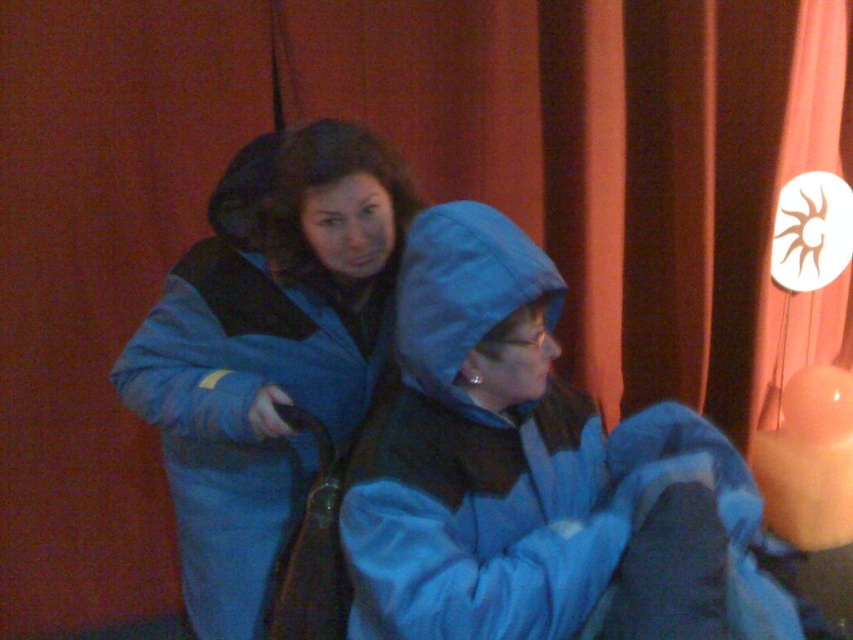
You are trying to decide which coat to wear for a walk in the cold evening. You see the blue fleece jacket at center and the blue fuzzy coat at center in the image. Which one is shorter in height?

The blue fleece jacket at center is not as tall as the blue fuzzy coat at center, so the blue fleece jacket at center is shorter in height.

You are a photographer standing at the camera position. You want to take a closeup of the blue fleece jacket at center. Considering the distance, can you get a clear shot without zooming?

The blue fleece jacket at center is 94.42 centimeters away from camera, so you can get a clear shot without zooming as this distance is within typical camera focus range for closeups.

You are trying to decide which coat to take for a walk. You see a blue fleece jacket at center and a blue fuzzy coat at center. Which one is on the left side?

The blue fuzzy coat at center is on the left side because the blue fleece jacket at center is positioned on the right side of it.